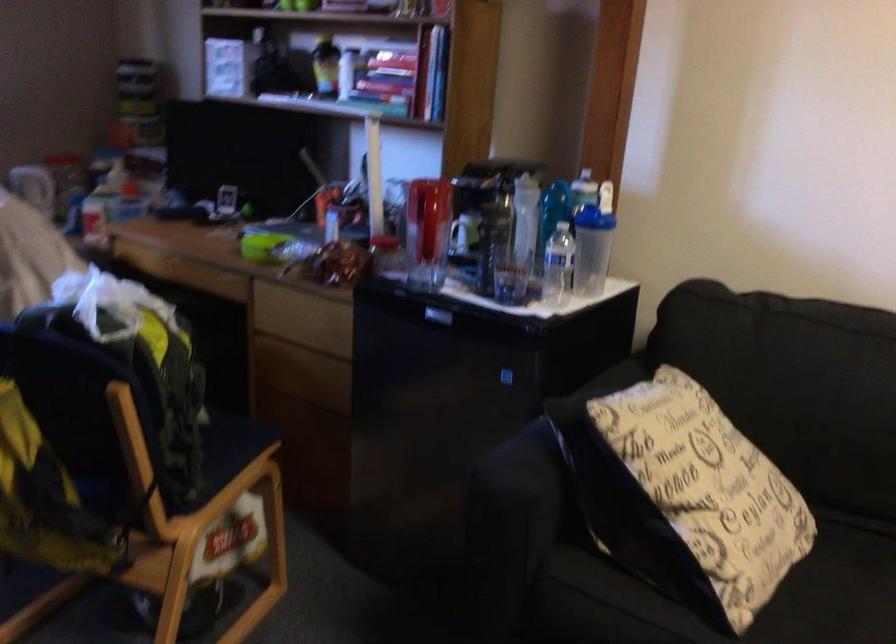
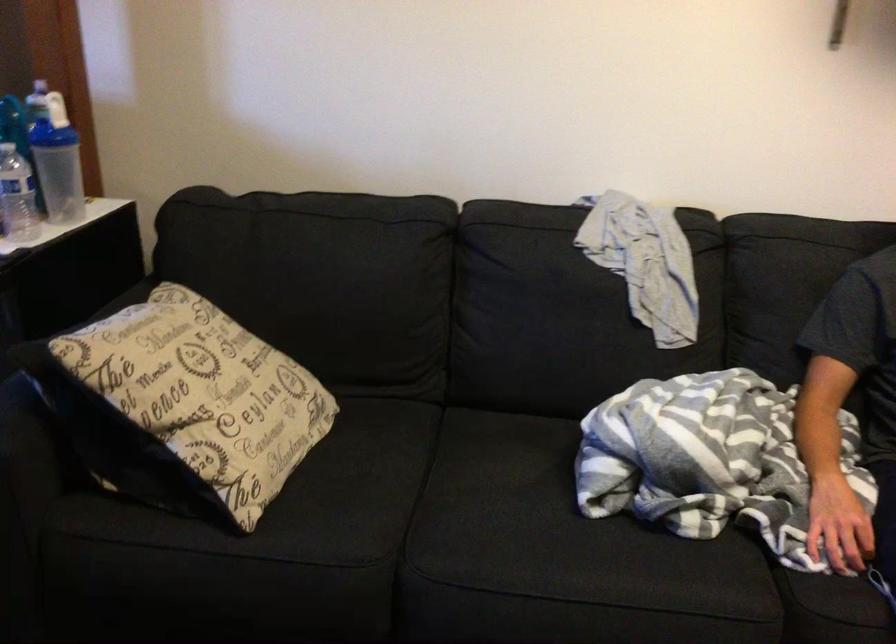
Locate, in the second image, the point that corresponds to point 595,243 in the first image.

(56, 161)